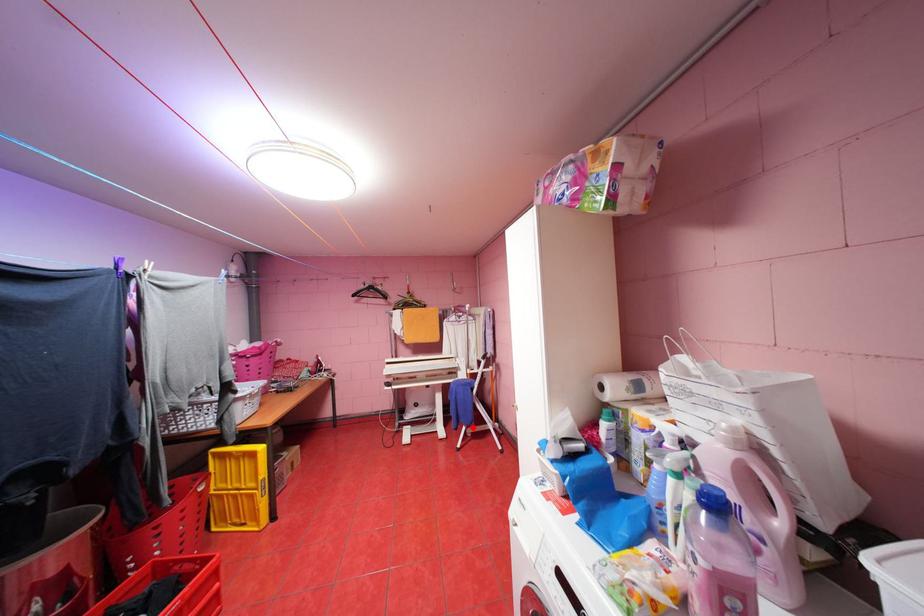
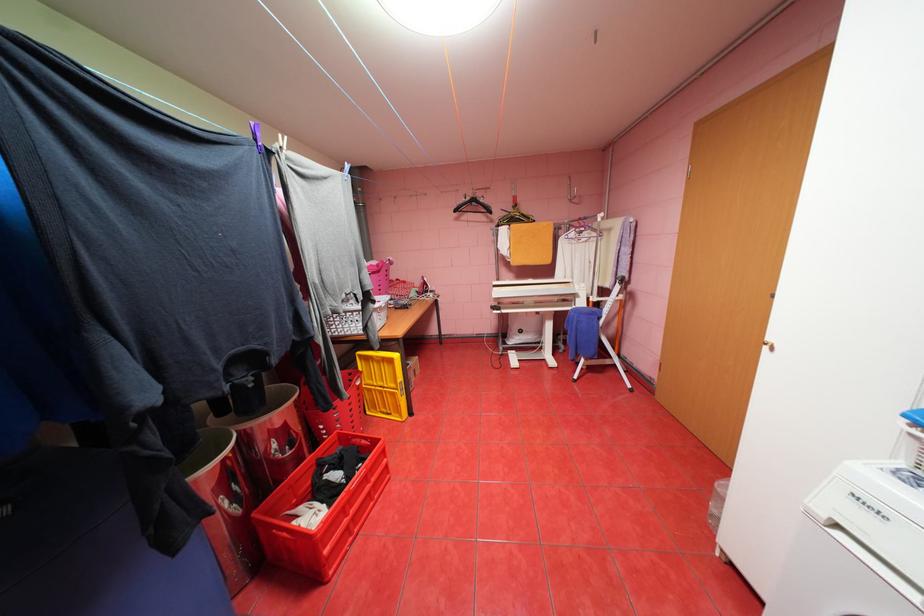
Question: I am providing you with two images of the same scene from different viewpoints. Image1 has a red point marked. In image2, the corresponding 3D location appears at what relative position? Reply with the corresponding letter.

Choices:
 (A) Closer
 (B) Farther

Answer: (A)